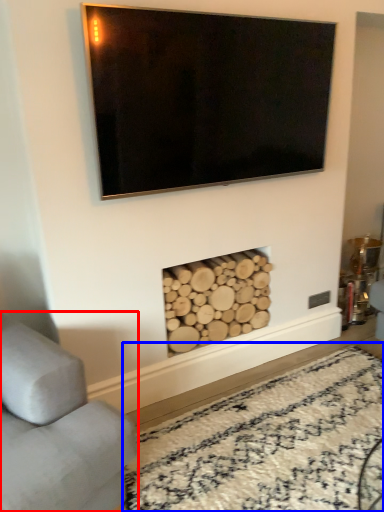
Question: Which object appears closest to the camera in this image, studio couch (highlighted by a red box) or plain (highlighted by a blue box)?

Choices:
 (A) studio couch
 (B) plain

Answer: (A)